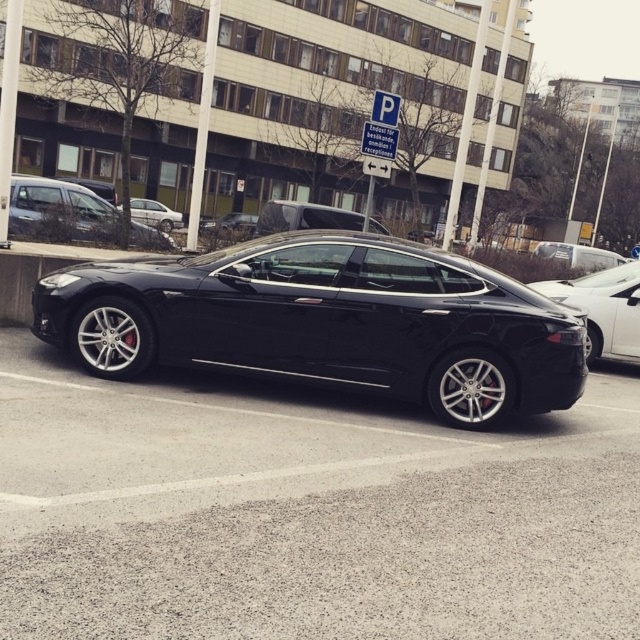
Question: Which of these objects is positioned closest to the glossy black car at center?

Choices:
 (A) matte black car at center
 (B) silver metallic sedan at center

Answer: (A)

Question: Is glossy black car at center above black matte car at center?

Choices:
 (A) yes
 (B) no

Answer: (B)

Question: Which of the following is the closest to the observer?

Choices:
 (A) matte black car at center
 (B) shiny silver sedan at center
 (C) black glossy car at center
 (D) silver metallic sedan at center

Answer: (C)

Question: Is black glossy car at center above shiny silver sedan at center?

Choices:
 (A) no
 (B) yes

Answer: (A)

Question: Among these points, which one is farthest from the camera?

Choices:
 (A) pyautogui.click(x=120, y=378)
 (B) pyautogui.click(x=61, y=513)
 (C) pyautogui.click(x=572, y=253)
 (D) pyautogui.click(x=29, y=196)

Answer: (C)

Question: Considering the relative positions of black metallic sedan at center and black matte car at center in the image provided, where is black metallic sedan at center located with respect to black matte car at center?

Choices:
 (A) above
 (B) below

Answer: (B)